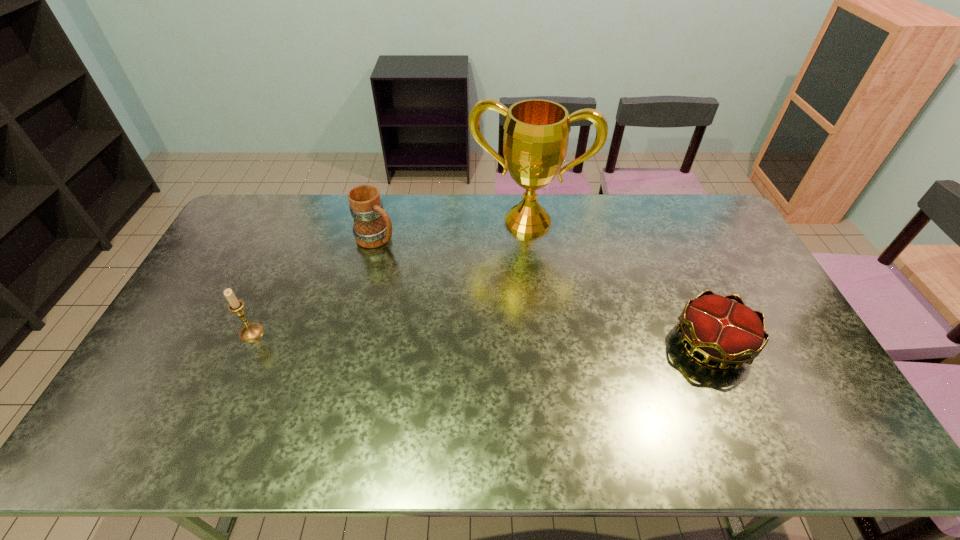
Locate an element on the screen. The width and height of the screenshot is (960, 540). the leftmost object is located at coordinates (251, 331).

I want to click on the rightmost object, so pyautogui.click(x=730, y=333).

Locate an element on the screen. The height and width of the screenshot is (540, 960). crown is located at coordinates (730, 333).

I want to click on mug, so click(x=372, y=228).

Identify the location of the tallest object. (536, 132).

You are a GUI agent. You are given a task and a screenshot of the screen. Output one action in this format:
    pyautogui.click(x=<x>, y=<y>)
    Task: Click on the award
    
    Given the screenshot: What is the action you would take?
    pyautogui.click(x=536, y=132)

Identify the location of vacant space located 0.200m on the front of the candle holder. Image resolution: width=960 pixels, height=540 pixels. (218, 407).

Find the location of a particular element. This screenshot has width=960, height=540. free space located 0.090m on the front of the shortest object is located at coordinates (740, 408).

Image resolution: width=960 pixels, height=540 pixels. Identify the location of free space located on the side of the mug with the handle. (477, 299).

Locate an element on the screen. This screenshot has height=540, width=960. free space located on the side of the mug with the handle is located at coordinates (455, 286).